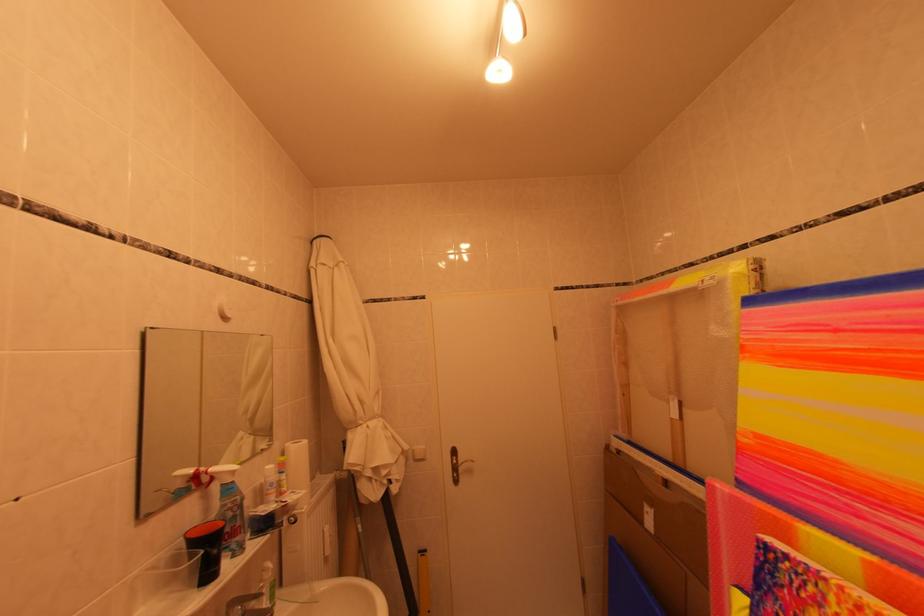
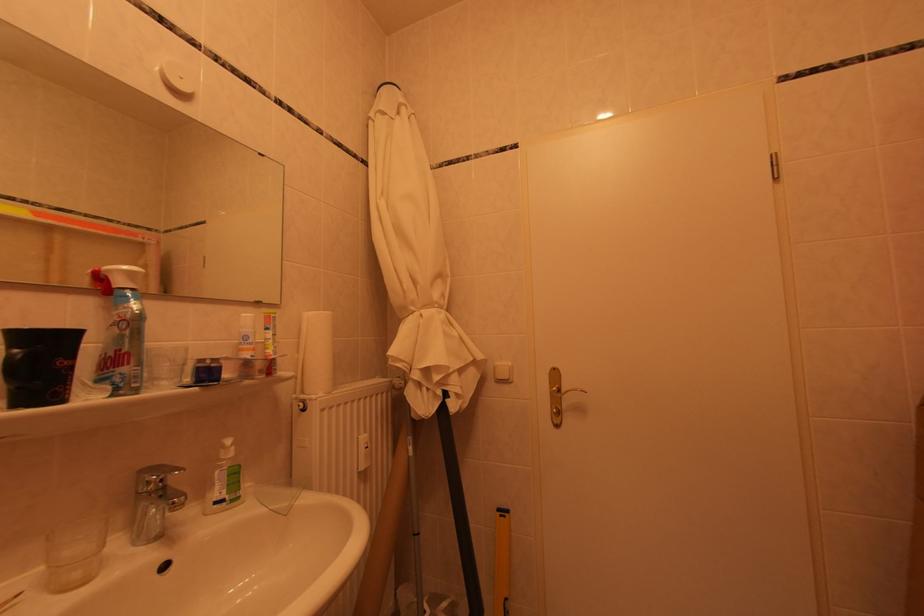
Locate, in the second image, the point that corresponds to (x=468, y=467) in the first image.

(572, 395)